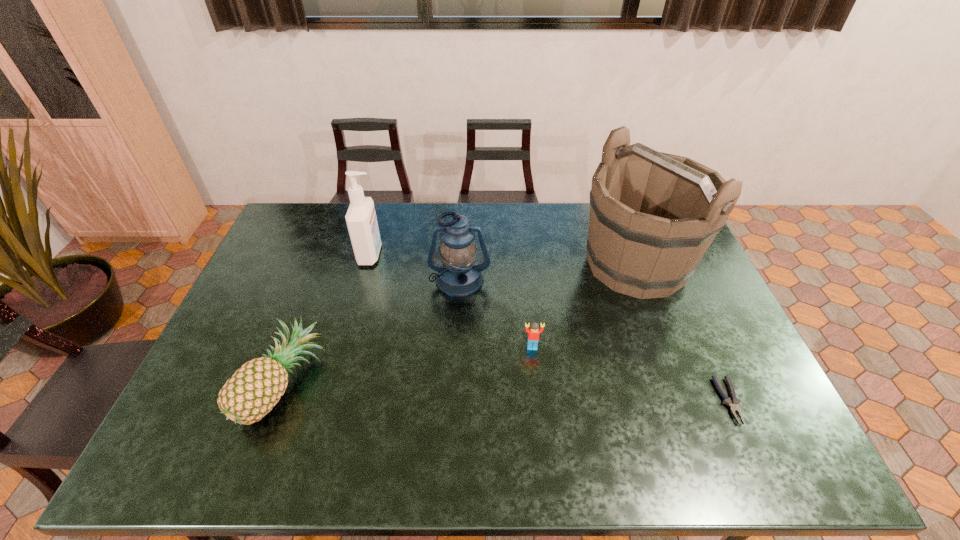
The width and height of the screenshot is (960, 540). What are the coordinates of `unoccupied position between the fourth shortest object and the Lego` in the screenshot? It's located at (496, 314).

In order to click on empty space that is in between the pineapple and the cleansing agent in this screenshot , I will do `click(328, 319)`.

Where is `vacant region between the shortest object and the fifth shortest object`? vacant region between the shortest object and the fifth shortest object is located at coordinates (550, 327).

At what (x,y) coordinates should I click in order to perform the action: click on free space between the bucket and the third object from right to left. Please return your answer as a coordinate pair (x, y). This screenshot has height=540, width=960. Looking at the image, I should click on (585, 306).

Identify the location of free space between the second tallest object and the third tallest object. Image resolution: width=960 pixels, height=540 pixels. tap(415, 267).

Where is `vacant area between the fourth object from left to right and the bucket`? The width and height of the screenshot is (960, 540). vacant area between the fourth object from left to right and the bucket is located at coordinates (585, 306).

Select which object appears as the fourth closest to the shortest object. Please provide its 2D coordinates. Your answer should be formatted as a tuple, i.e. [(x, y)], where the tuple contains the x and y coordinates of a point satisfying the conditions above.

[(255, 388)]

Identify the location of object that can be found as the third closest to the pineapple. The height and width of the screenshot is (540, 960). tap(533, 332).

Identify the location of vacant space that satisfies the following two spatial constraints: 1. on the front label of the bucket; 2. on the right side of the cleansing agent. This screenshot has height=540, width=960. (369, 264).

I want to click on vacant space that satisfies the following two spatial constraints: 1. on the back side of the bucket; 2. on the front label of the fifth shortest object, so click(x=633, y=254).